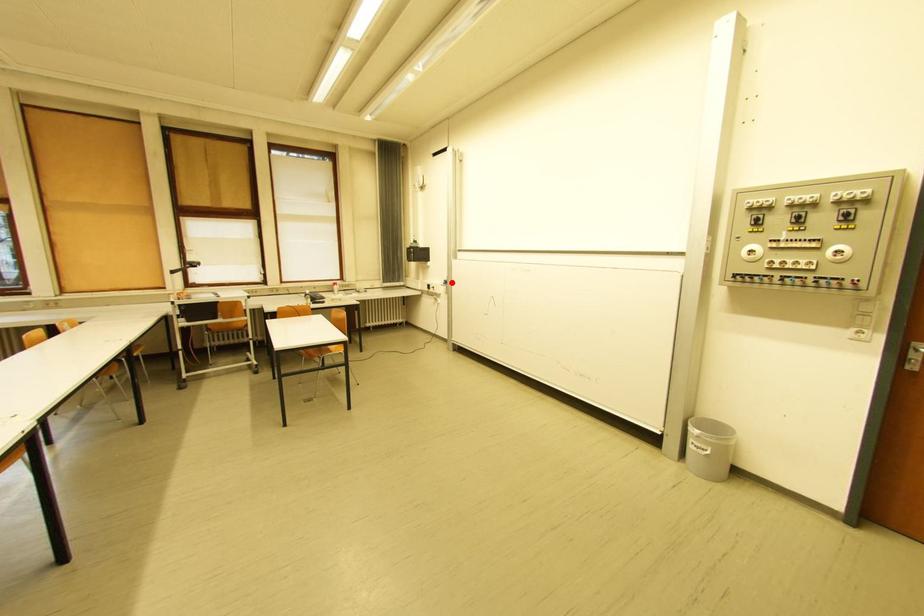
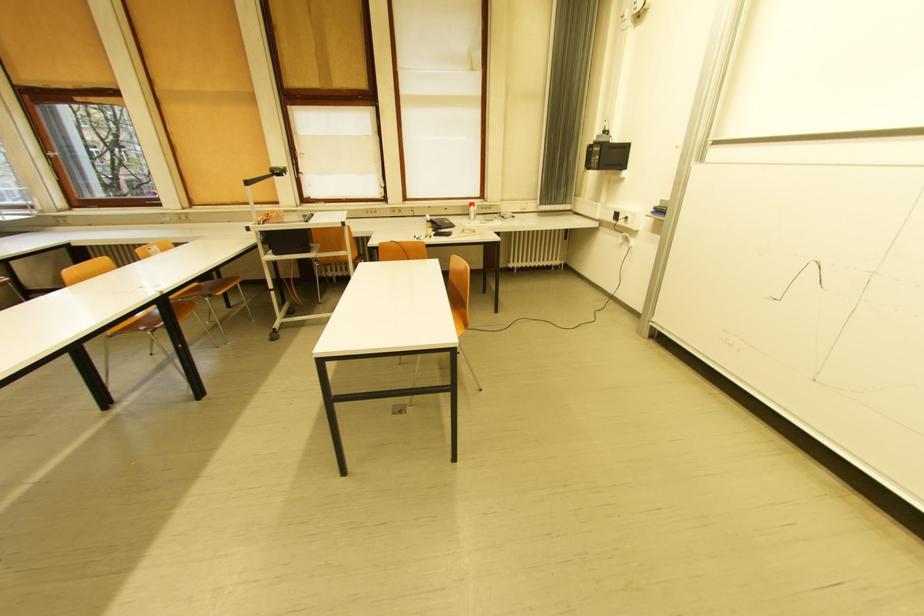
The point at the highlighted location is marked in the first image. Where is the corresponding point in the second image?

(662, 209)